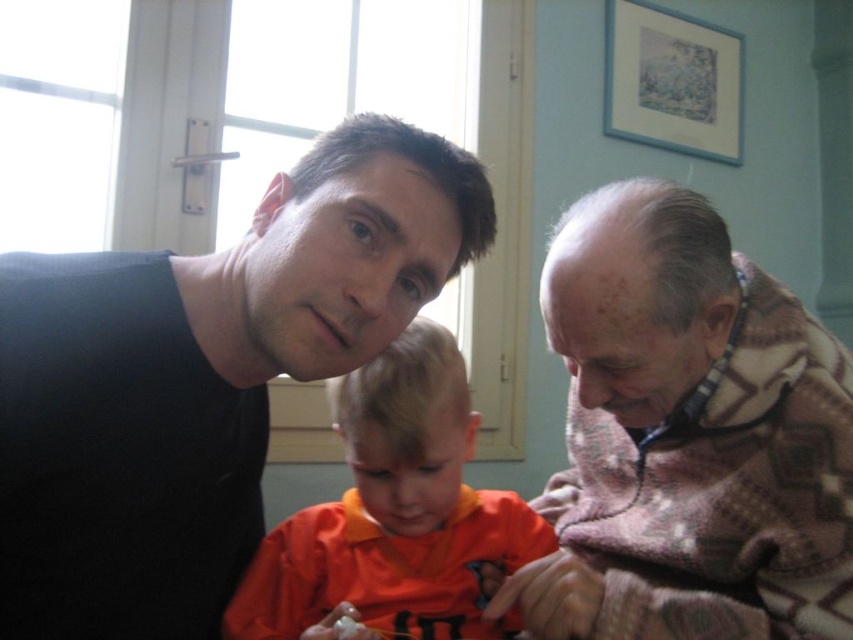
Looking at this image, how distant is knitted wool sweater at right from orange fabric shirt at center?

They are 6.93 inches apart.

Who is taller, knitted wool sweater at right or orange fabric shirt at center?

knitted wool sweater at right

Image resolution: width=853 pixels, height=640 pixels. What do you see at coordinates (688, 436) in the screenshot? I see `knitted wool sweater at right` at bounding box center [688, 436].

Where is `knitted wool sweater at right`? Image resolution: width=853 pixels, height=640 pixels. knitted wool sweater at right is located at coordinates (688, 436).

Between point (265, 451) and point (450, 426), which one is positioned behind?

Positioned behind is point (265, 451).

Is knitted sweater at right to the left of orange fabric shirt at center from the viewer's perspective?

Correct, you'll find knitted sweater at right to the left of orange fabric shirt at center.

Which is in front, point (99, 340) or point (399, 531)?

Point (99, 340)

At what (x,y) coordinates should I click in order to perform the action: click on knitted sweater at right. Please return your answer as a coordinate pair (x, y). The height and width of the screenshot is (640, 853). Looking at the image, I should click on (201, 378).

Does knitted sweater at right have a smaller size compared to knitted wool sweater at right?

No, knitted sweater at right is not smaller than knitted wool sweater at right.

Can you confirm if knitted sweater at right is bigger than knitted wool sweater at right?

Correct, knitted sweater at right is larger in size than knitted wool sweater at right.

Is point (125, 614) closer to camera compared to point (703, 605)?

No.

In order to click on knitted sweater at right in this screenshot , I will do `click(201, 378)`.